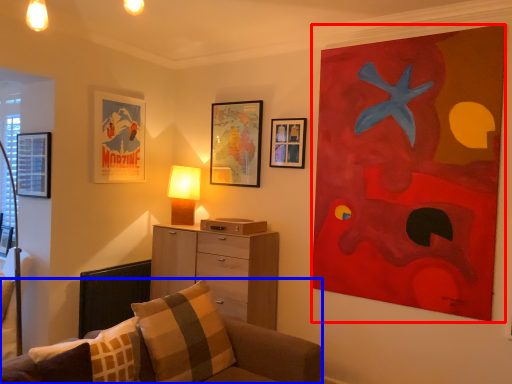
Question: Among these objects, which one is nearest to the camera, picture frame (highlighted by a red box) or studio couch (highlighted by a blue box)?

Choices:
 (A) picture frame
 (B) studio couch

Answer: (B)